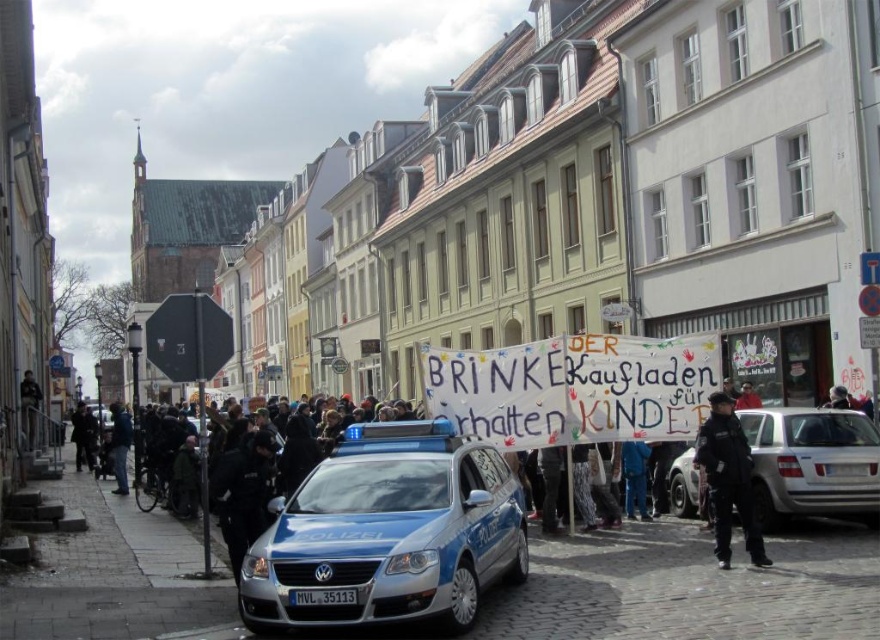
Question: Which point is farther to the camera?

Choices:
 (A) blue metallic police car at center
 (B) silver metallic sedan at center-right
 (C) black uniform at center
 (D) dark brown coat at lower left

Answer: (D)

Question: Is blue metallic police car at center in front of black uniform at center?

Choices:
 (A) no
 (B) yes

Answer: (B)

Question: Can you confirm if blue metallic police car at center is thinner than dark brown coat at lower left?

Choices:
 (A) no
 (B) yes

Answer: (B)

Question: Which object appears closest to the camera in this image?

Choices:
 (A) dark brown coat at lower left
 (B) silver metallic sedan at center-right

Answer: (B)

Question: Among these points, which one is nearest to the camera?

Choices:
 (A) (294, 563)
 (B) (81, 436)
 (C) (739, 440)

Answer: (A)

Question: Is blue metallic police car at center bigger than silver metallic sedan at center-right?

Choices:
 (A) no
 (B) yes

Answer: (B)